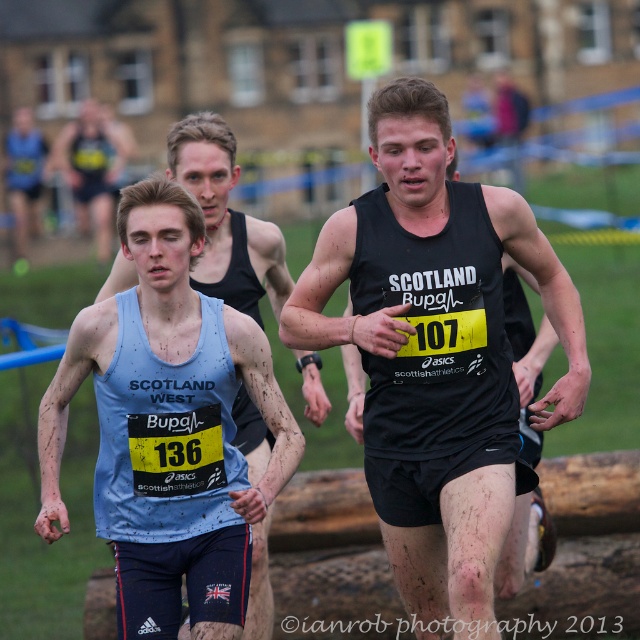
Question: Which point is closer to the camera?

Choices:
 (A) matte black tank top at center
 (B) black matte tank top at center
 (C) light blue tank top at left
 (D) light blue fabric tank top at center

Answer: (B)

Question: Is black matte tank top at center positioned behind light blue fabric tank top at center?

Choices:
 (A) yes
 (B) no

Answer: (B)

Question: Among these points, which one is farthest from the camera?

Choices:
 (A) (195, 129)
 (B) (72, 170)
 (C) (404, 308)

Answer: (B)

Question: Which point is closer to the camera?

Choices:
 (A) (36, 189)
 (B) (244, 636)
 (C) (404, 474)

Answer: (C)

Question: Can you confirm if black matte tank top at center is positioned to the right of light blue tank top at left?

Choices:
 (A) yes
 (B) no

Answer: (A)

Question: Can you confirm if black matte tank top at center is positioned above light blue tank top at left?

Choices:
 (A) no
 (B) yes

Answer: (A)